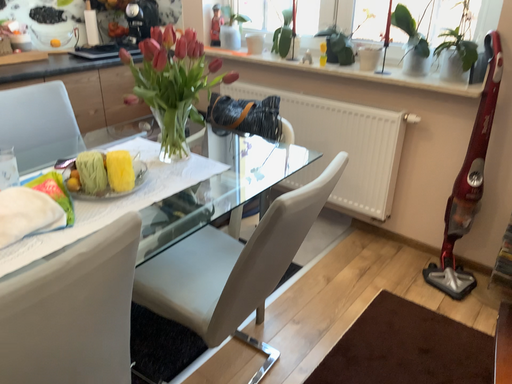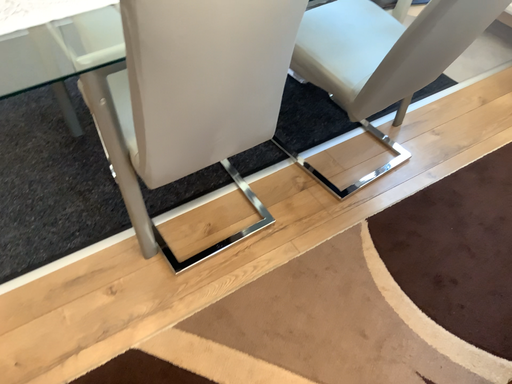
Question: Which way did the camera rotate in the video?

Choices:
 (A) rotated left
 (B) rotated right

Answer: (A)